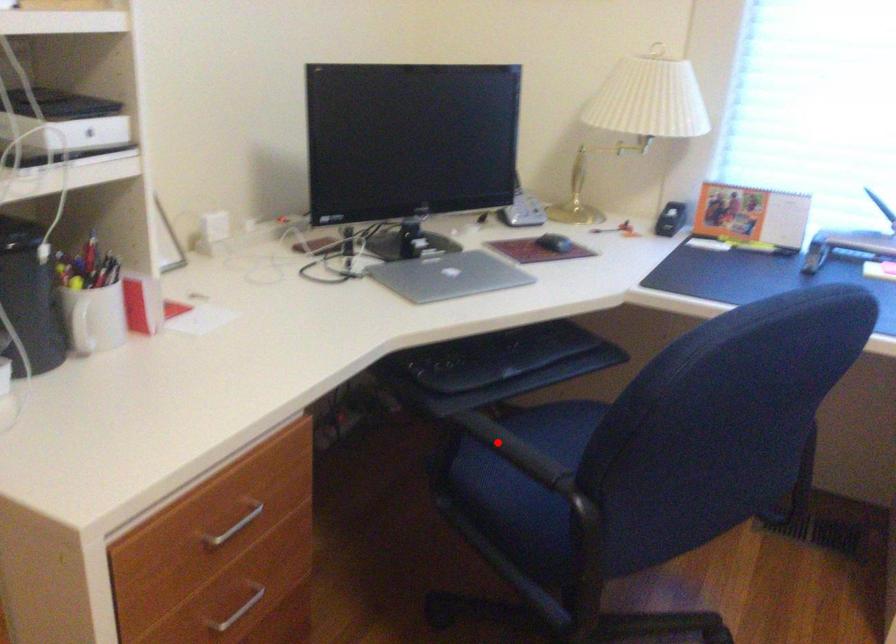
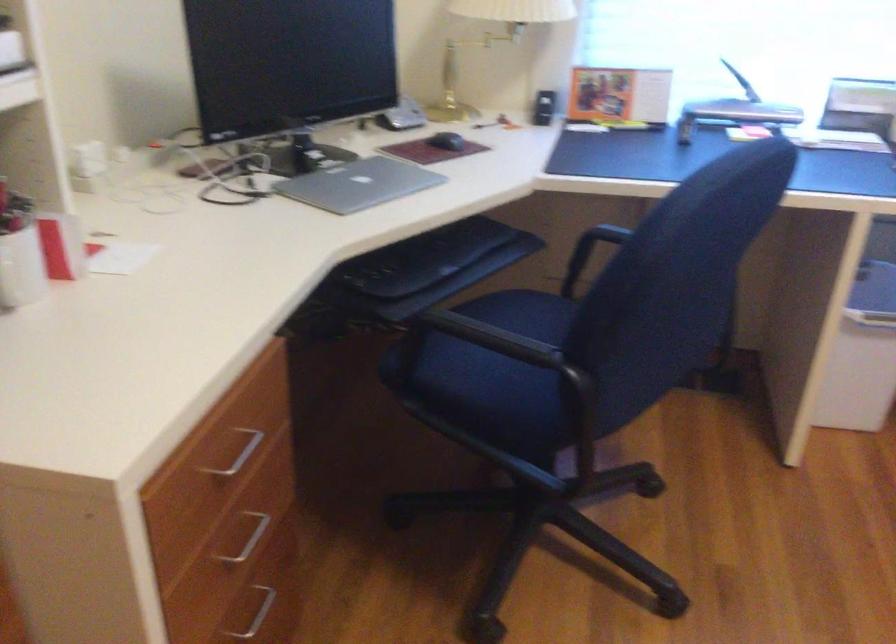
Find the pixel in the second image that matches the highlighted location in the first image.

(478, 339)